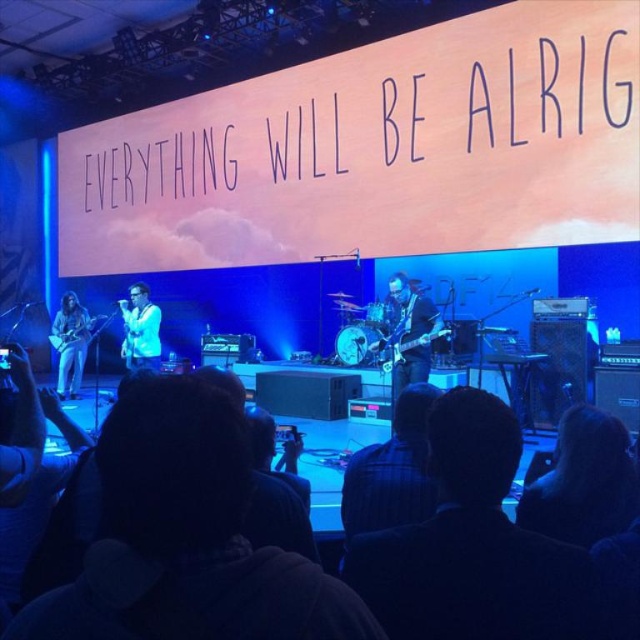
Question: Which of these objects is positioned closest to the matte black guitar at left?

Choices:
 (A) white glossy microphone at center
 (B) glossy electric guitar at center
 (C) shiny black guitar at center

Answer: (A)

Question: From the image, what is the correct spatial relationship of matte black guitar at left in relation to white glossy microphone at center?

Choices:
 (A) above
 (B) below

Answer: (B)

Question: Which of these objects is positioned closest to the white glossy microphone at center?

Choices:
 (A) shiny black guitar at center
 (B) glossy electric guitar at center

Answer: (A)

Question: Among these objects, which one is farthest from the camera?

Choices:
 (A) shiny black guitar at center
 (B) white glossy microphone at center
 (C) glossy electric guitar at center

Answer: (B)

Question: Can you confirm if shiny black guitar at center is positioned below matte black guitar at left?

Choices:
 (A) no
 (B) yes

Answer: (A)

Question: From the image, what is the correct spatial relationship of shiny black guitar at center in relation to white glossy microphone at center?

Choices:
 (A) left
 (B) right

Answer: (B)